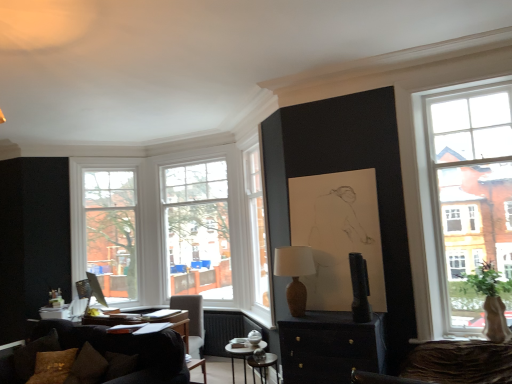
Question: From the image's perspective, relative to dark brown leather chair at center, is matte black cabinet at center above or below?

Choices:
 (A) above
 (B) below

Answer: (A)

Question: From a real-world perspective, is matte black cabinet at center above or below dark brown leather chair at center?

Choices:
 (A) below
 (B) above

Answer: (B)

Question: Which object is positioned closest to the brown textured pillow at lower left?

Choices:
 (A) clear glass window at left, which is counted as the 2th window, starting from the right
 (B) metallic silver side table at center
 (C) black glossy television at center
 (D) matte brown vase at center
 (E) green leafy plant at right

Answer: (B)

Question: Which is farther from the black glossy television at center?

Choices:
 (A) brown textured pillow at lower left
 (B) dark brown fabric couch at lower left
 (C) matte brown vase at center
 (D) clear glass window at center, which ranks as the 1th window in right-to-left order
 (E) dark brown leather chair at center

Answer: (D)